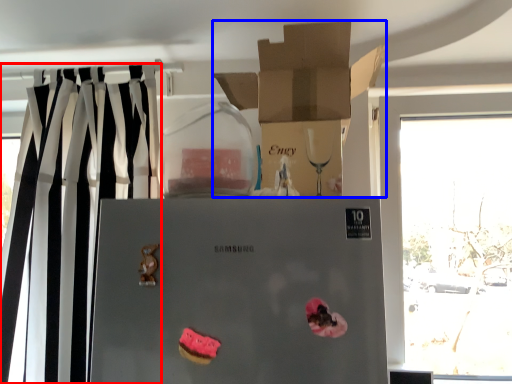
Question: Which of the following is the farthest to the observer, curtain (highlighted by a red box) or box (highlighted by a blue box)?

Choices:
 (A) curtain
 (B) box

Answer: (A)